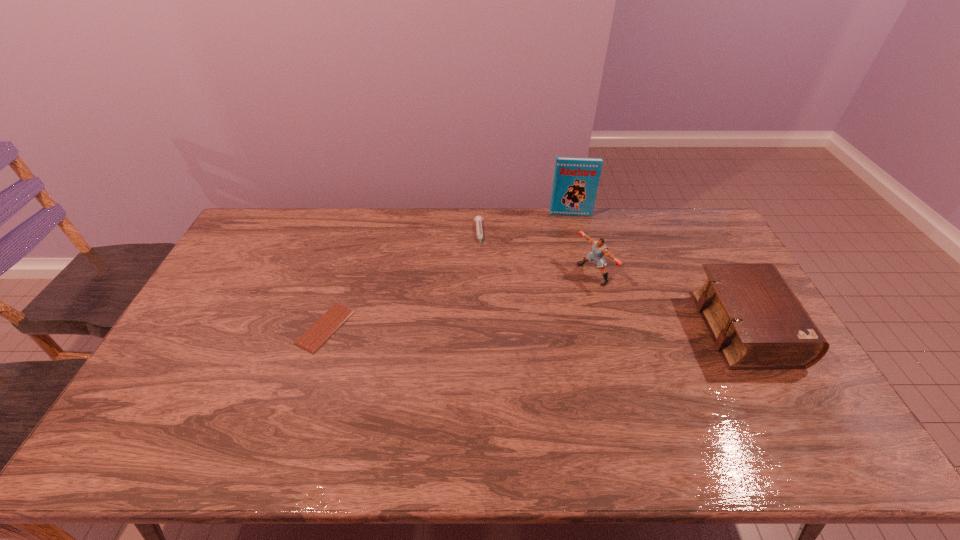
Locate an element on the screen. free region located 0.250m on the front-facing side of the third farthest object is located at coordinates (520, 313).

What are the coordinates of `vacant space located on the front-facing side of the third farthest object` in the screenshot? It's located at (492, 326).

Where is `free location located 0.330m on the front-facing side of the third farthest object`? The image size is (960, 540). free location located 0.330m on the front-facing side of the third farthest object is located at coordinates (498, 323).

The width and height of the screenshot is (960, 540). Identify the location of vacant space situated at the needle end of the syringe. pos(483,305).

At what (x,y) coordinates should I click in order to perform the action: click on free space located at the needle end of the syringe. Please return your answer as a coordinate pair (x, y). Looking at the image, I should click on (483, 296).

Locate an element on the screen. This screenshot has width=960, height=540. vacant space positioned at the needle end of the syringe is located at coordinates (485, 325).

This screenshot has height=540, width=960. Identify the location of free space located 0.050m on the front cover of the tallest object. (570, 224).

Locate an element on the screen. The width and height of the screenshot is (960, 540). free space located 0.400m on the front cover of the tallest object is located at coordinates (579, 289).

This screenshot has height=540, width=960. I want to click on free space located 0.280m on the front cover of the tallest object, so click(x=576, y=265).

Locate an element on the screen. This screenshot has width=960, height=540. syringe located at the far edge is located at coordinates click(478, 219).